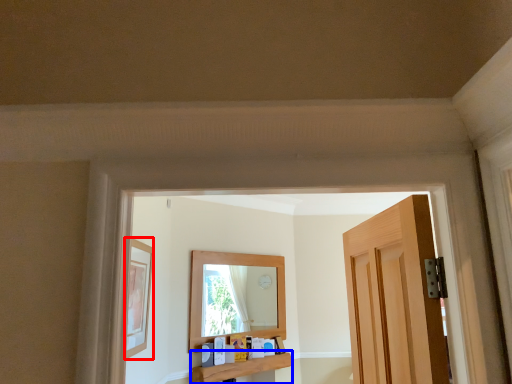
Question: Which of the following is the closest to the observer, picture frame (highlighted by a red box) or window sill (highlighted by a blue box)?

Choices:
 (A) picture frame
 (B) window sill

Answer: (A)